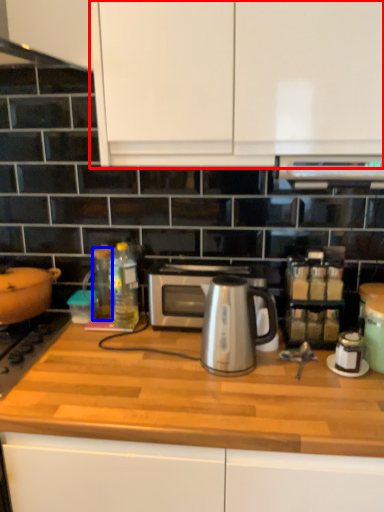
Question: Which of the following is the farthest to the observer, cabinetry (highlighted by a red box) or bottle (highlighted by a blue box)?

Choices:
 (A) cabinetry
 (B) bottle

Answer: (B)